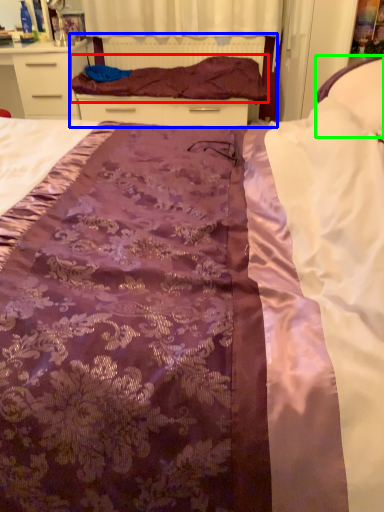
Question: Estimate the real-world distances between objects in this image. Which object is farther from blanket (highlighted by a red box), bed frame (highlighted by a blue box) or pillow (highlighted by a green box)?

Choices:
 (A) bed frame
 (B) pillow

Answer: (B)